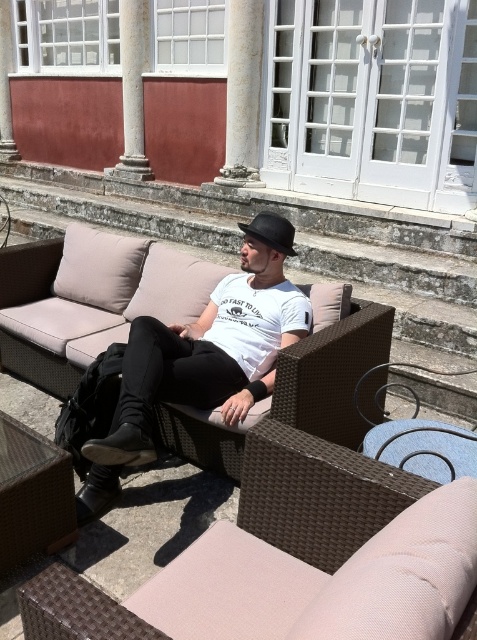
Is pale pink fabric chair at center below matte white t-shirt at center?

Indeed, pale pink fabric chair at center is positioned under matte white t-shirt at center.

Is pale pink fabric chair at center closer to camera compared to matte white t-shirt at center?

Answer: Yes, it is in front of matte white t-shirt at center.

Locate an element on the screen. Image resolution: width=477 pixels, height=640 pixels. pale pink fabric chair at center is located at coordinates (323, 580).

The width and height of the screenshot is (477, 640). I want to click on pale pink fabric chair at center, so click(x=323, y=580).

Locate an element on the screen. This screenshot has width=477, height=640. white matte t-shirt at center is located at coordinates (256, 321).

Between white matte t-shirt at center and smooth stone column at upper left, which one is positioned lower?

Positioned lower is white matte t-shirt at center.

Does point (240, 356) come in front of point (146, 177)?

Yes, point (240, 356) is closer to viewer.

You are a GUI agent. You are given a task and a screenshot of the screen. Output one action in this format:
    pyautogui.click(x=<x>, y=<y>)
    Task: Click on the white matte t-shirt at center
    This screenshot has height=640, width=477.
    Given the screenshot: What is the action you would take?
    pyautogui.click(x=256, y=321)

Is brown wicker side table at lower left wider than white stone column at center?

No.

Who is lower down, brown wicker side table at lower left or white stone column at center?

brown wicker side table at lower left is lower down.

Who is more forward, (x=64, y=461) or (x=237, y=83)?

Point (x=64, y=461) is more forward.

You are a GUI agent. You are given a task and a screenshot of the screen. Output one action in this format:
    pyautogui.click(x=<x>, y=<y>)
    Task: Click on the brown wicker side table at lower left
    
    Given the screenshot: What is the action you would take?
    pyautogui.click(x=32, y=496)